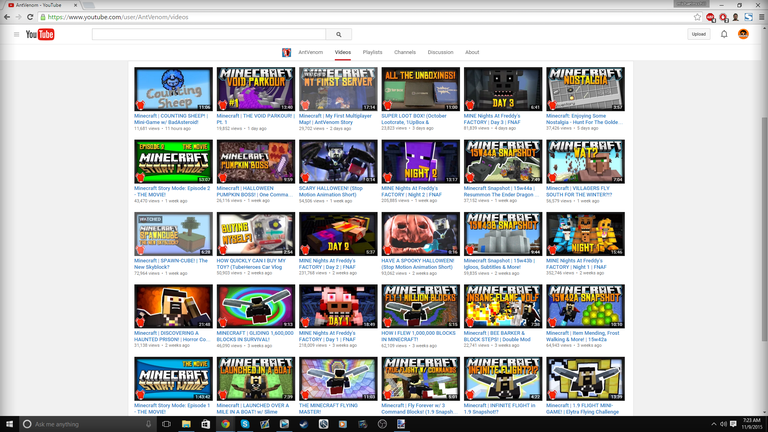
Identify the location of inquiry bar. (74, 424).